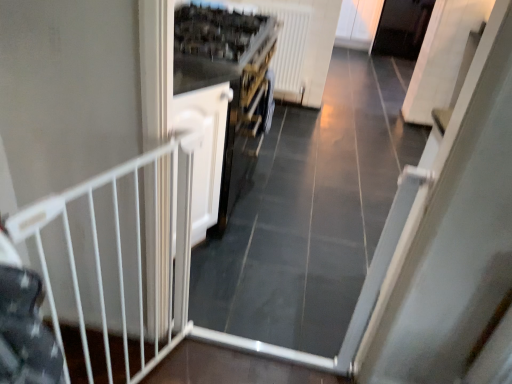
Locate an element on the screen. Image resolution: width=512 pixels, height=384 pixels. white plastic radiator at upper center is located at coordinates (289, 48).

Image resolution: width=512 pixels, height=384 pixels. What do you see at coordinates (204, 150) in the screenshot?
I see `white matte door at center` at bounding box center [204, 150].

Locate an element on the screen. This screenshot has width=512, height=384. white metal gate at left is located at coordinates (114, 264).

Where is `white plastic radiator at upper center`? The height and width of the screenshot is (384, 512). white plastic radiator at upper center is located at coordinates (289, 48).

Can you confirm if white metal gate at left is wider than white plastic radiator at upper center?

In fact, white metal gate at left might be narrower than white plastic radiator at upper center.

Locate an element on the screen. This screenshot has height=384, width=512. rail to the left of white plastic radiator at upper center is located at coordinates (114, 264).

Considering the sizes of objects white metal gate at left and white plastic radiator at upper center in the image provided, who is bigger, white metal gate at left or white plastic radiator at upper center?

With larger size is white plastic radiator at upper center.

Can you confirm if white metal gate at left is taller than white plastic radiator at upper center?

Correct, white metal gate at left is much taller as white plastic radiator at upper center.

Considering the sizes of objects white matte door at center and white metal gate at left in the image provided, who is shorter, white matte door at center or white metal gate at left?

white matte door at center.

Can you tell me how much white matte door at center and white metal gate at left differ in facing direction?

The angle between the facing direction of white matte door at center and the facing direction of white metal gate at left is 23.7 degrees.

How far apart are white matte door at center and white metal gate at left?

white matte door at center and white metal gate at left are 18.91 inches apart.

Is white matte door at center looking in the opposite direction of white metal gate at left?

No, white matte door at center is not facing the opposite direction of white metal gate at left.

Can you tell me how much white metal gate at left and white matte door at center differ in facing direction?

The facing directions of white metal gate at left and white matte door at center are 23.7 degrees apart.

Is white metal gate at left looking in the opposite direction of white matte door at center?

white metal gate at left is not turned away from white matte door at center.

Is white metal gate at left positioned in front of white matte door at center?

That is True.

From the image's perspective, is white metal gate at left located above or below white matte door at center?

From the image's perspective, white metal gate at left appears below white matte door at center.

From a real-world perspective, is white plastic radiator at upper center positioned over white matte door at center based on gravity?

Incorrect, from a real-world perspective, white plastic radiator at upper center is lower than white matte door at center.

Considering their positions, is white plastic radiator at upper center located in front of or behind white matte door at center?

Clearly, white plastic radiator at upper center is behind white matte door at center.

Looking at this image, which is correct: white plastic radiator at upper center is inside white matte door at center, or outside of it?

The correct answer is: outside.

Is white metal gate at left surrounded by white plastic radiator at upper center?

That's incorrect, white metal gate at left is not inside white plastic radiator at upper center.

Is white plastic radiator at upper center taller or shorter than white metal gate at left?

In the image, white plastic radiator at upper center appears to be shorter than white metal gate at left.

Can you confirm if white plastic radiator at upper center is thinner than white metal gate at left?

No, white plastic radiator at upper center is not thinner than white metal gate at left.

Is white plastic radiator at upper center bigger than white metal gate at left?

Indeed, white plastic radiator at upper center has a larger size compared to white metal gate at left.

Is white matte door at center touching white plastic radiator at upper center?

No, white matte door at center is not with white plastic radiator at upper center.

Which is behind, point (198, 212) or point (297, 85)?

The point (297, 85) is farther from the camera.

In terms of width, does white matte door at center look wider or thinner when compared to white plastic radiator at upper center?

In the image, white matte door at center appears to be wider than white plastic radiator at upper center.

Does white matte door at center come behind white plastic radiator at upper center?

No.

Where is `radiator above the white metal gate at left (from the image's perspective)`? radiator above the white metal gate at left (from the image's perspective) is located at coordinates (289, 48).

Locate an element on the screen. door positioned vertically above the white metal gate at left (from a real-world perspective) is located at coordinates (204, 150).

Considering their positions, is white plastic radiator at upper center positioned further to white metal gate at left than white matte door at center?

white plastic radiator at upper center is further to white metal gate at left.

Looking at the image, which one is located closer to white matte door at center, white plastic radiator at upper center or white metal gate at left?

Among the two, white metal gate at left is located nearer to white matte door at center.

Which object lies nearer to the anchor point white metal gate at left, white matte door at center or white plastic radiator at upper center?

white matte door at center lies closer to white metal gate at left than the other object.

Based on their spatial positions, is white metal gate at left or white matte door at center further from white plastic radiator at upper center?

Among the two, white metal gate at left is located further to white plastic radiator at upper center.

Considering their positions, is white matte door at center positioned further to white plastic radiator at upper center than white metal gate at left?

The object further to white plastic radiator at upper center is white metal gate at left.

Based on their spatial positions, is white metal gate at left or white plastic radiator at upper center further from white matte door at center?

The object further to white matte door at center is white plastic radiator at upper center.

Identify the location of door located between white metal gate at left and white plastic radiator at upper center in the depth direction. This screenshot has width=512, height=384. [204, 150].